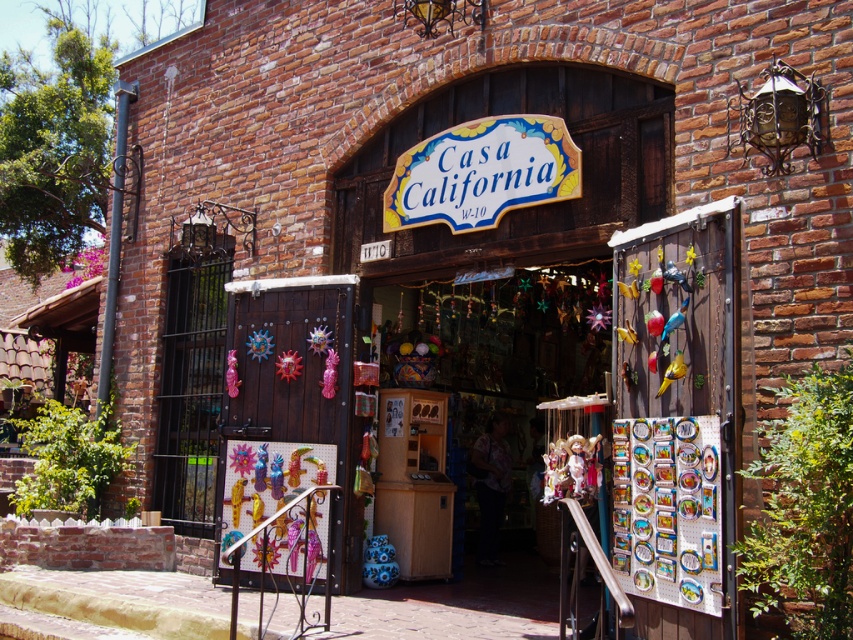
Question: Which point is closer to the camera?

Choices:
 (A) metallic painted door at center
 (B) white painted wood sign at center

Answer: (B)

Question: Does metallic painted door at center appear under white painted wood sign at center?

Choices:
 (A) yes
 (B) no

Answer: (A)

Question: Can you confirm if metallic painted door at center is bigger than white painted wood sign at center?

Choices:
 (A) no
 (B) yes

Answer: (B)

Question: Which point is farther to the camera?

Choices:
 (A) tap(308, 324)
 (B) tap(537, 195)

Answer: (A)

Question: Does metallic painted door at center appear over white painted wood sign at center?

Choices:
 (A) yes
 (B) no

Answer: (B)